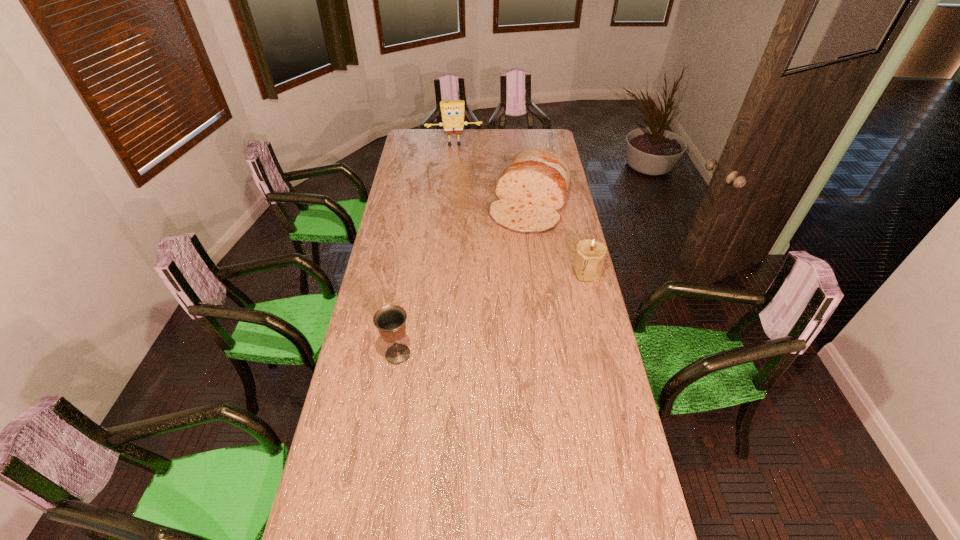
Where is `chalice`? The image size is (960, 540). chalice is located at coordinates (390, 320).

Locate an element on the screen. This screenshot has width=960, height=540. candle_holder is located at coordinates [590, 254].

Locate an element on the screen. the farthest object is located at coordinates (452, 112).

Where is `sponge`? This screenshot has height=540, width=960. sponge is located at coordinates [x=452, y=112].

The image size is (960, 540). In order to click on the second farthest object in this screenshot , I will do `click(532, 188)`.

The height and width of the screenshot is (540, 960). Find the location of `free location located 0.340m on the back of the chalice`. free location located 0.340m on the back of the chalice is located at coordinates (410, 277).

Image resolution: width=960 pixels, height=540 pixels. Find the location of `vacant space located 0.240m on the front of the second nearest object`. vacant space located 0.240m on the front of the second nearest object is located at coordinates (602, 328).

Identify the location of free spot located 0.300m on the face of the sponge. (460, 176).

The image size is (960, 540). I want to click on vacant space situated on the face of the sponge, so click(457, 155).

This screenshot has width=960, height=540. I want to click on vacant space located on the face of the sponge, so click(x=460, y=182).